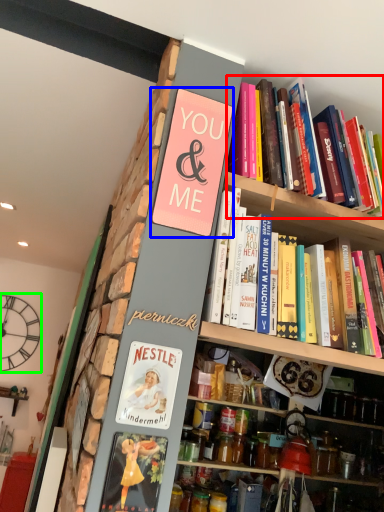
Question: Considering the real-world distances, which object is closest to book (highlighted by a red box)? paperback book (highlighted by a blue box) or clock (highlighted by a green box).

Choices:
 (A) paperback book
 (B) clock

Answer: (A)